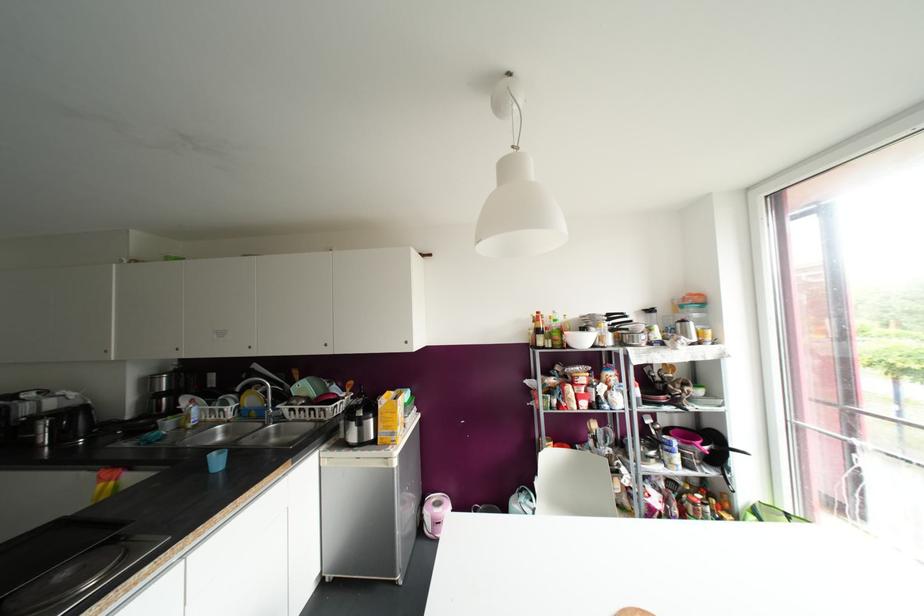
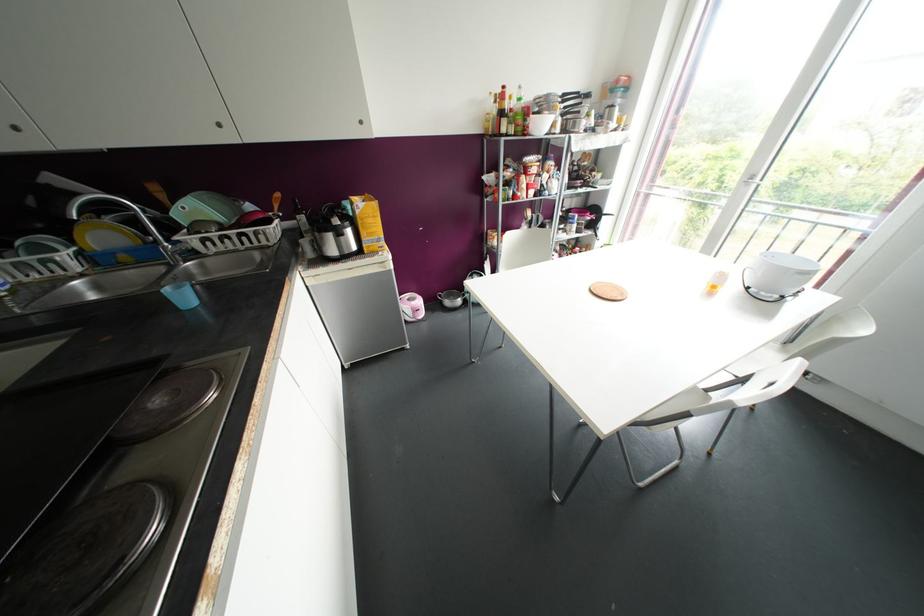
The point at (435, 509) is marked in the first image. Where is the corresponding point in the second image?

(412, 302)